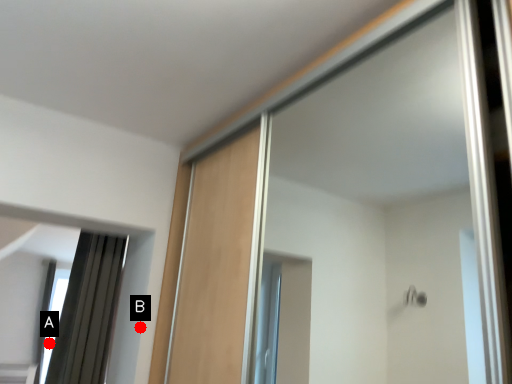
Question: Two points are circled on the image, labeled by A and B beside each circle. Which point is closer to the camera?

Choices:
 (A) A is closer
 (B) B is closer

Answer: (B)